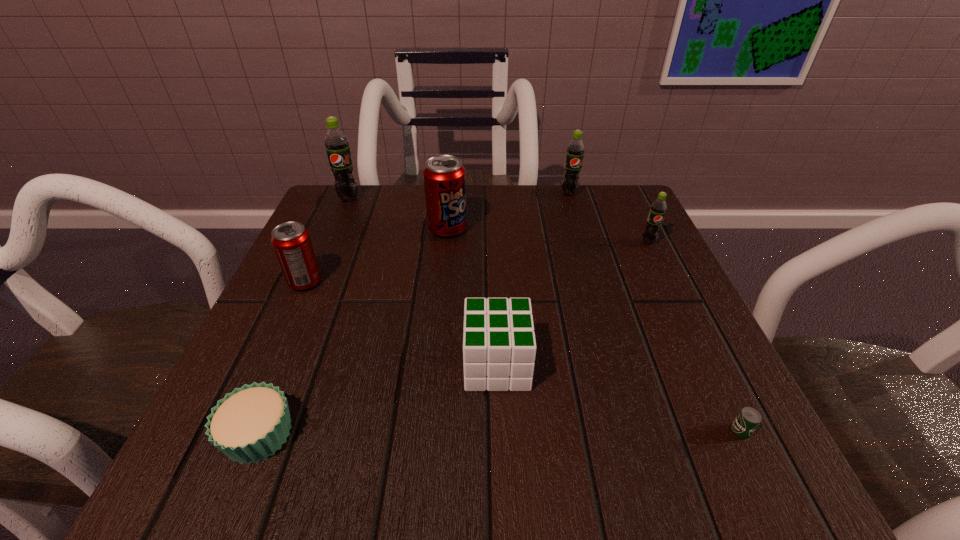
In order to click on free area in between the shortest object and the second biggest green soda in this screenshot , I will do `click(655, 312)`.

Find the location of `free spot between the rightmost green soda and the second green soda from right to left`. free spot between the rightmost green soda and the second green soda from right to left is located at coordinates (609, 218).

Image resolution: width=960 pixels, height=540 pixels. Find the location of `empty location between the beer can and the red cube`. empty location between the beer can and the red cube is located at coordinates (618, 398).

The image size is (960, 540). What are the coordinates of `vacant space in between the tallest object and the second shortest object` in the screenshot? It's located at [304, 316].

At what (x,y) coordinates should I click in order to perform the action: click on free space that is in between the bigger red soda can and the beer can. Please return your answer as a coordinate pair (x, y). This screenshot has height=540, width=960. Looking at the image, I should click on (594, 330).

Identify the location of free space between the leftmost green soda and the cupcake. The height and width of the screenshot is (540, 960). (304, 316).

Where is `the fifth closest object to the tallest object`? This screenshot has width=960, height=540. the fifth closest object to the tallest object is located at coordinates (248, 425).

Identify which object is the fifth closest to the beer can. Please provide its 2D coordinates. Your answer should be formatted as a tuple, i.e. [(x, y)], where the tuple contains the x and y coordinates of a point satisfying the conditions above.

[(248, 425)]

Select which soda can is the fourth closest to the tallest object. Please provide its 2D coordinates. Your answer should be formatted as a tuple, i.e. [(x, y)], where the tuple contains the x and y coordinates of a point satisfying the conditions above.

[(658, 208)]

Locate which soda can is the fourth closest to the red cube. Please provide its 2D coordinates. Your answer should be formatted as a tuple, i.e. [(x, y)], where the tuple contains the x and y coordinates of a point satisfying the conditions above.

[(575, 150)]